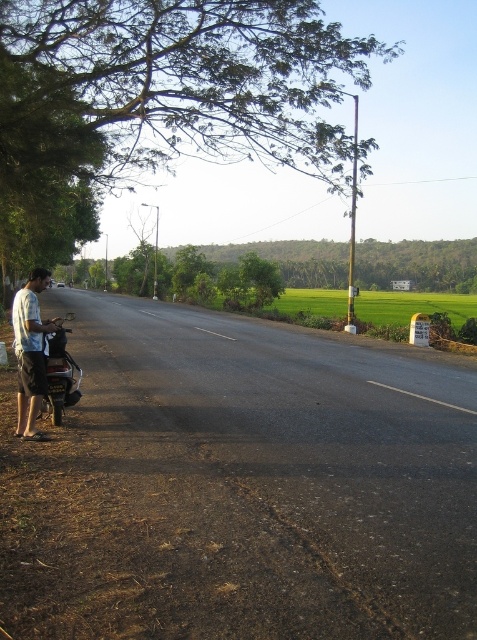
Question: Which point appears closest to the camera in this image?

Choices:
 (A) (62, 356)
 (B) (33, 275)

Answer: (B)

Question: Does light blue cotton shirt at left appear under metallic silver scooter at left?

Choices:
 (A) no
 (B) yes

Answer: (B)

Question: Is light blue cotton shirt at left below metallic silver scooter at left?

Choices:
 (A) no
 (B) yes

Answer: (B)

Question: Which object appears farthest from the camera in this image?

Choices:
 (A) metallic silver scooter at left
 (B) light blue cotton shirt at left

Answer: (A)

Question: Is light blue cotton shirt at left positioned at the back of metallic silver scooter at left?

Choices:
 (A) no
 (B) yes

Answer: (A)

Question: Which object is closer to the camera taking this photo?

Choices:
 (A) light blue cotton shirt at left
 (B) metallic silver scooter at left

Answer: (A)